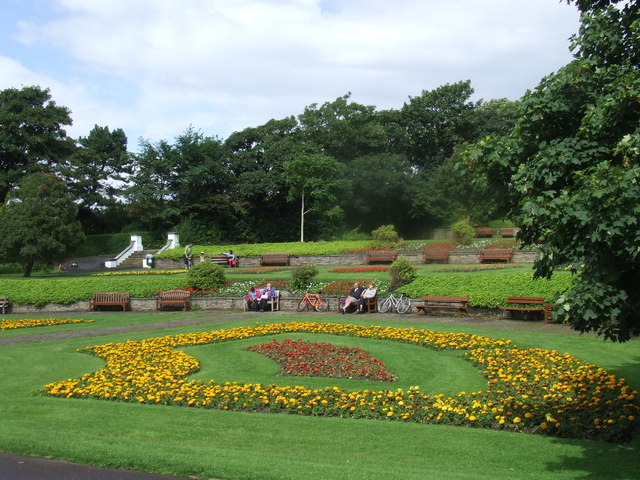
The image size is (640, 480). I want to click on wall, so click(x=223, y=303), click(x=139, y=301), click(x=166, y=258), click(x=248, y=259), click(x=326, y=260), click(x=406, y=252), click(x=524, y=256), click(x=470, y=256), click(x=481, y=309).